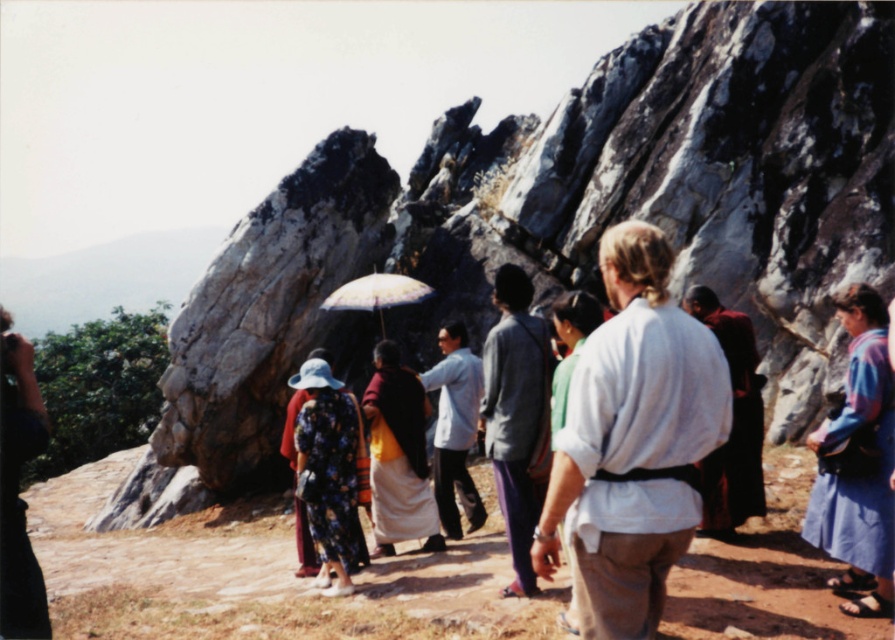
Between point (374, 394) and point (459, 422), which one is positioned in front?

Point (374, 394) is more forward.

The image size is (895, 640). Find the location of `yellow woolen robe at center`. yellow woolen robe at center is located at coordinates (398, 456).

Can you confirm if light blue fabric shirt at center is positioned below white paper umbrella at center?

Yes, light blue fabric shirt at center is below white paper umbrella at center.

Is light blue fabric shirt at center bigger than white paper umbrella at center?

Yes, light blue fabric shirt at center is bigger than white paper umbrella at center.

Does point (472, 396) lie behind point (390, 275)?

No, it is in front of (390, 275).

You are a GUI agent. You are given a task and a screenshot of the screen. Output one action in this format:
    pyautogui.click(x=<x>, y=<y>)
    Task: Click on the light blue fabric shirt at center
    This screenshot has width=895, height=640.
    Given the screenshot: What is the action you would take?
    pyautogui.click(x=455, y=428)

Is yellow woolen robe at center bigger than white paper umbrella at center?

No.

The height and width of the screenshot is (640, 895). In order to click on yellow woolen robe at center in this screenshot , I will do `click(398, 456)`.

Where is `yellow woolen robe at center`? The width and height of the screenshot is (895, 640). yellow woolen robe at center is located at coordinates (398, 456).